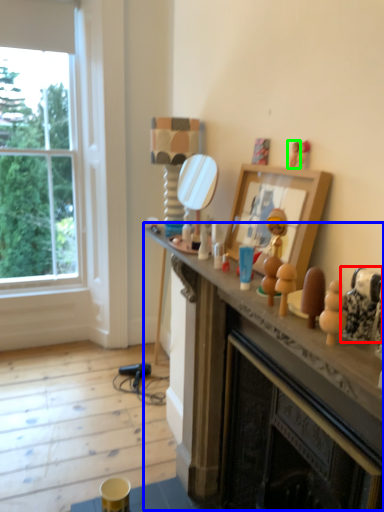
Question: Based on their relative distances, which object is nearer to toy (highlighted by a red box)? Choose from mantle (highlighted by a blue box) and toy (highlighted by a green box).

Choices:
 (A) mantle
 (B) toy

Answer: (B)